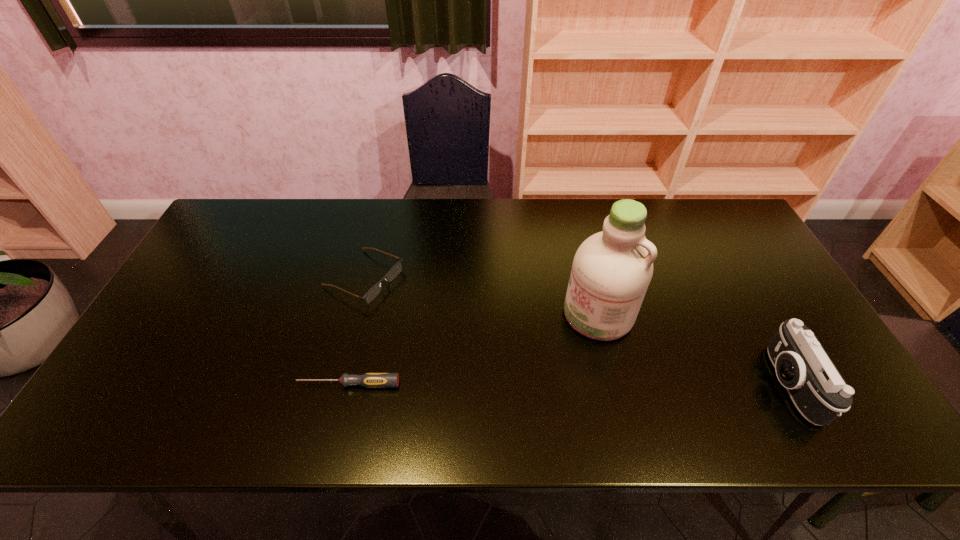
Where is `vacant region located 0.210m on the front lens of the camera`? The height and width of the screenshot is (540, 960). vacant region located 0.210m on the front lens of the camera is located at coordinates (681, 384).

The height and width of the screenshot is (540, 960). I want to click on blank area located 0.220m on the front lens of the camera, so click(x=677, y=384).

Locate an element on the screen. This screenshot has width=960, height=540. vacant area situated 0.220m on the front-facing side of the spectacles is located at coordinates (462, 323).

At what (x,y) coordinates should I click in order to perform the action: click on vacant space located on the front-facing side of the spectacles. Please return your answer as a coordinate pair (x, y). This screenshot has width=960, height=540. Looking at the image, I should click on (491, 337).

Locate an element on the screen. vacant space located on the front-facing side of the spectacles is located at coordinates (501, 341).

Locate an element on the screen. The width and height of the screenshot is (960, 540). free space located 0.050m on the front label of the second object from right to left is located at coordinates (564, 343).

You are a GUI agent. You are given a task and a screenshot of the screen. Output one action in this format:
    pyautogui.click(x=<x>, y=<y>)
    Task: Click on the free location located on the front label of the second object from right to left
    
    Given the screenshot: What is the action you would take?
    pyautogui.click(x=519, y=379)

Where is `vacant region located 0.060m on the front label of the second object from right to left`? The height and width of the screenshot is (540, 960). vacant region located 0.060m on the front label of the second object from right to left is located at coordinates (561, 345).

Locate an element on the screen. This screenshot has width=960, height=540. screwdriver situated at the near edge is located at coordinates click(x=370, y=380).

Locate an element on the screen. The width and height of the screenshot is (960, 540). camera present at the near edge is located at coordinates (819, 392).